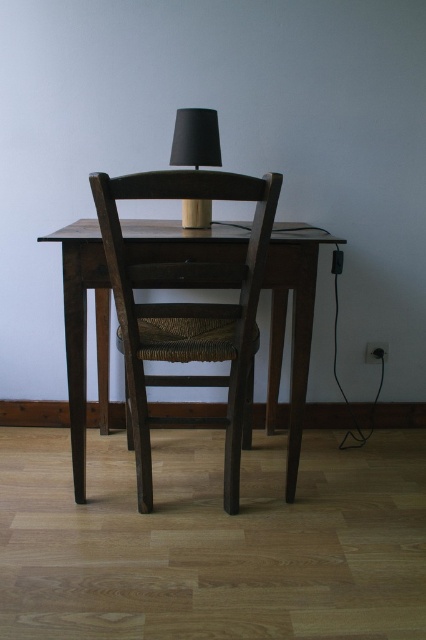
Does dark wood chair at center lie behind black matte table lamp at center?

No, dark wood chair at center is closer to the viewer.

Is point (212, 355) positioned in front of point (183, 225)?

Yes, it is in front of point (183, 225).

Where is `dark wood chair at center`? The width and height of the screenshot is (426, 640). dark wood chair at center is located at coordinates (187, 308).